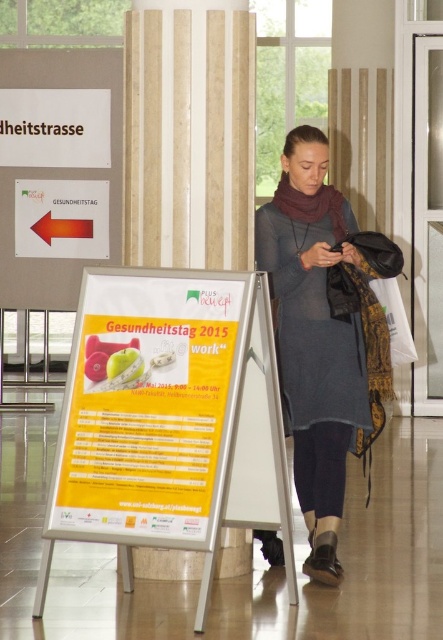
You are a photographer trying to capture the promotional poster in the background. You notice a matte gray dress at center and an orange glossy arrow at left. Which object is positioned to the right of the other?

The matte gray dress at center is positioned to the right of the orange glossy arrow at left.

You are standing in the hallway and need to place a new poster exactly where the yellow paperboard at center is currently located. What are the coordinates of the spot where you should place the new poster?

The coordinates for the yellow paperboard at center are at point [168,419], so you should place the new poster there.